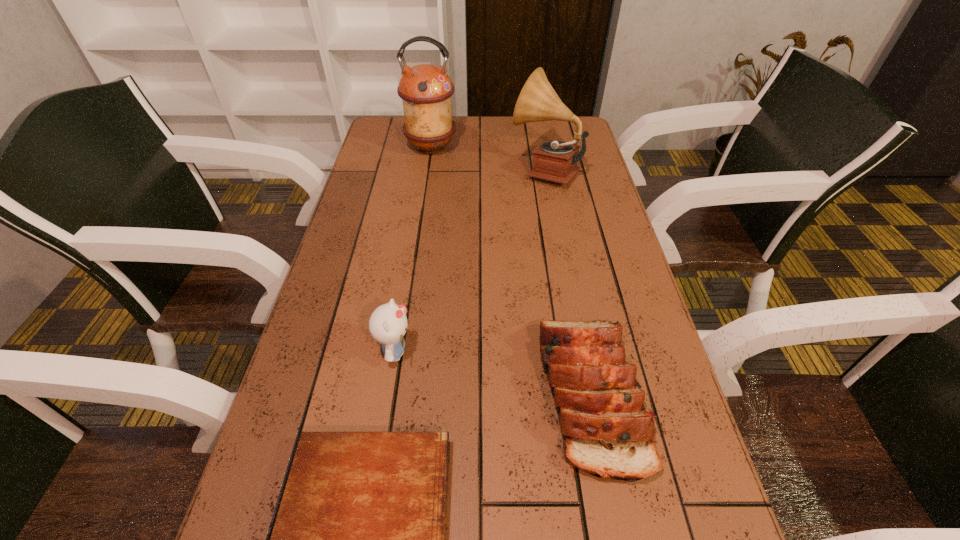
Image resolution: width=960 pixels, height=540 pixels. Identify the location of object located at the far edge. (426, 90).

Where is `oil lamp present at the left edge`? This screenshot has width=960, height=540. oil lamp present at the left edge is located at coordinates (426, 90).

This screenshot has width=960, height=540. In order to click on kitten situated at the left edge in this screenshot , I will do point(388,323).

Locate an element on the screen. The image size is (960, 540). phonograph record at the right edge is located at coordinates (556, 161).

You are a GUI agent. You are given a task and a screenshot of the screen. Output one action in this format:
    pyautogui.click(x=<x>, y=<y>)
    Task: Click on the bread that is positioned at the right edge
    The width and height of the screenshot is (960, 540).
    Given the screenshot: What is the action you would take?
    pyautogui.click(x=606, y=431)

Locate an element on the screen. Image resolution: width=960 pixels, height=540 pixels. object that is at the far left corner is located at coordinates (426, 90).

In the image, there is a desktop. Find the location of `vacant region at the left edge`. vacant region at the left edge is located at coordinates (379, 269).

Where is `free location at the right edge of the desktop`? free location at the right edge of the desktop is located at coordinates (612, 282).

The height and width of the screenshot is (540, 960). What are the coordinates of `empty space between the oil lamp and the second tallest object` in the screenshot? It's located at (488, 159).

Find the location of a particular element. The image size is (960, 540). vacant area that lies between the kitten and the phonograph record is located at coordinates (470, 261).